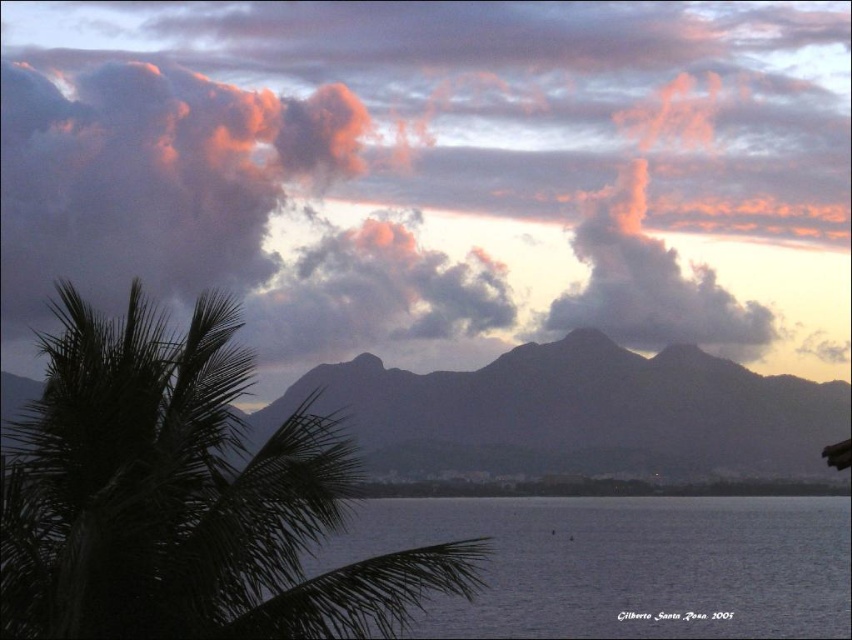
You are an astronomer analyzing the sunset scene. You need to locate the pink fluffy cloud at upper center in the image. What are its coordinates?

The pink fluffy cloud at upper center is located at coordinates (436, 173).